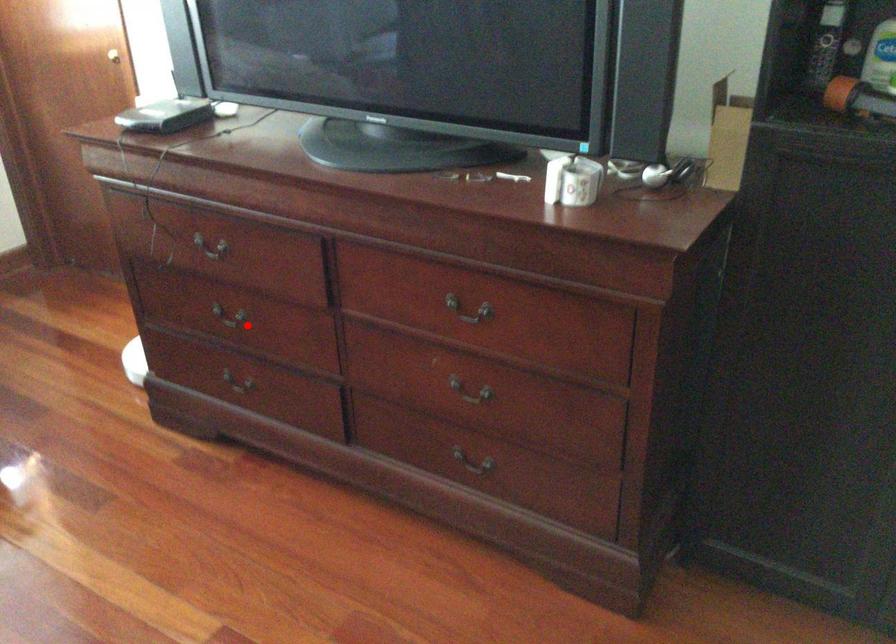
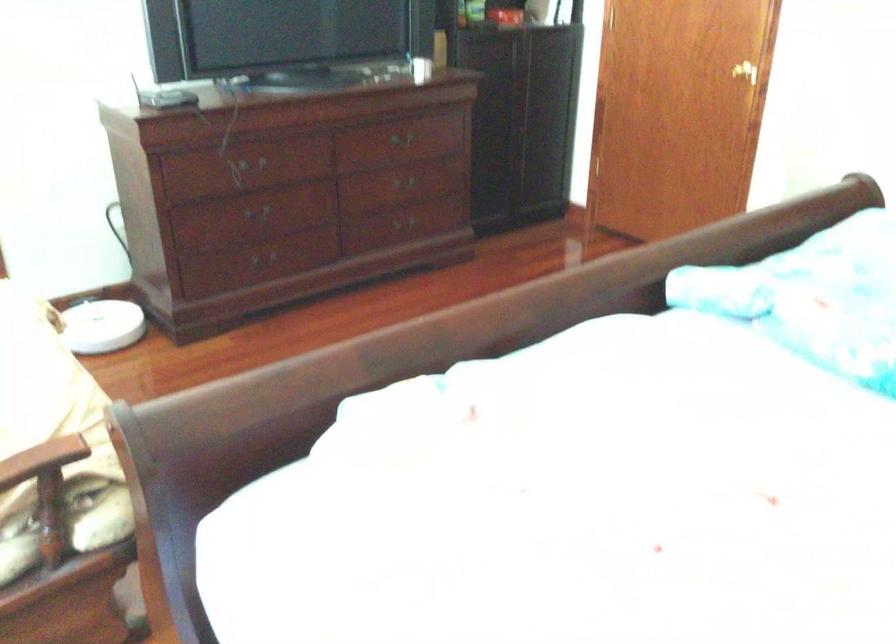
Find the pixel in the second image that matches the highlighted location in the first image.

(255, 210)